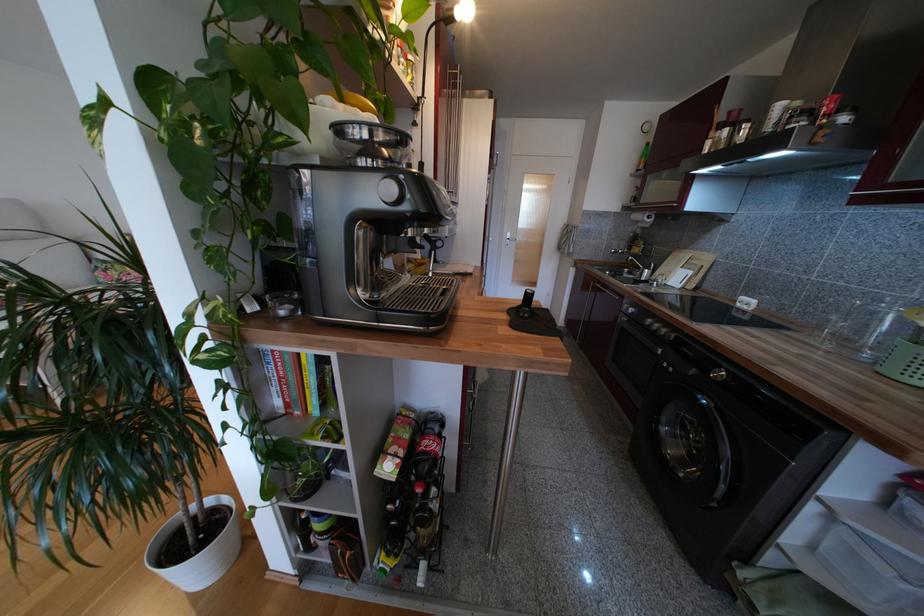
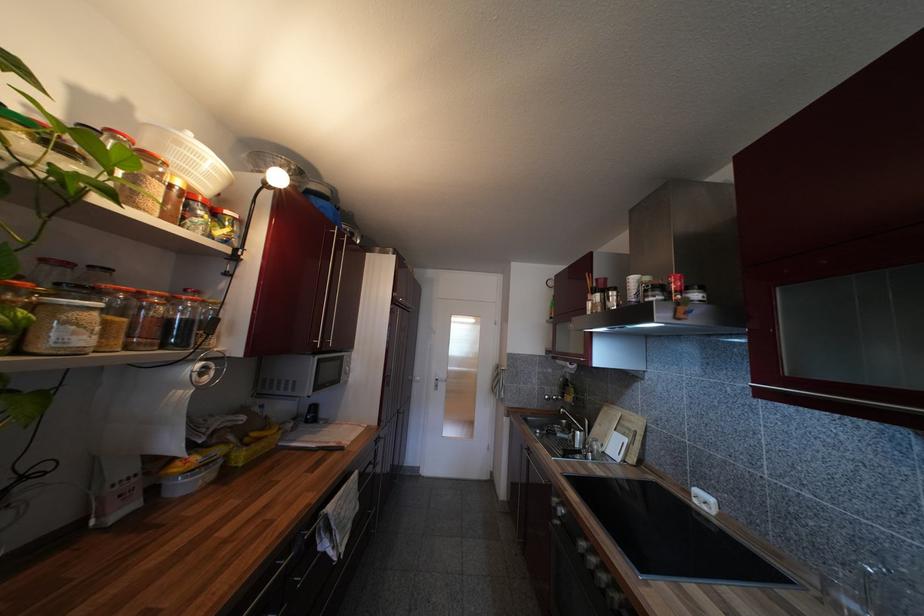
Locate, in the second image, the point that corresponds to point (669, 333) in the first image.

(609, 580)